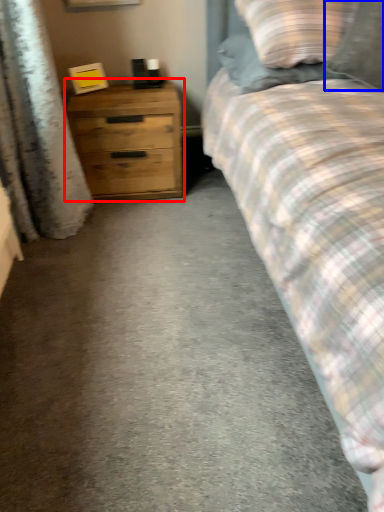
Question: Which object is further to the camera taking this photo, chest of drawers (highlighted by a red box) or pillow (highlighted by a blue box)?

Choices:
 (A) chest of drawers
 (B) pillow

Answer: (A)